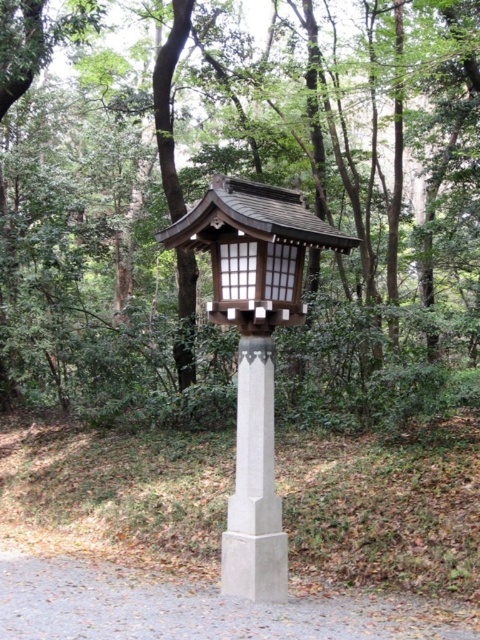
Does green leafy tree at center have a greater width compared to matte wood lantern at center?

Correct, the width of green leafy tree at center exceeds that of matte wood lantern at center.

Who is positioned more to the left, green leafy tree at center or matte wood lantern at center?

From the viewer's perspective, green leafy tree at center appears more on the left side.

I want to click on green leafy tree at center, so click(x=231, y=204).

Is green leafy tree at center closer to the viewer compared to gray concrete post at center?

Yes, green leafy tree at center is closer to the viewer.

Does green leafy tree at center have a greater width compared to gray concrete post at center?

Yes, green leafy tree at center is wider than gray concrete post at center.

Which is in front, point (170, 179) or point (241, 515)?

Point (241, 515) is in front.

The height and width of the screenshot is (640, 480). I want to click on green leafy tree at center, so click(231, 204).

Is matte wood lantern at center thinner than gray concrete post at center?

In fact, matte wood lantern at center might be wider than gray concrete post at center.

Can you confirm if matte wood lantern at center is positioned to the left of gray concrete post at center?

Incorrect, matte wood lantern at center is not on the left side of gray concrete post at center.

At what (x,y) coordinates should I click in order to perform the action: click on matte wood lantern at center. Please return your answer as a coordinate pair (x, y). The image size is (480, 640). Looking at the image, I should click on (253, 250).

Image resolution: width=480 pixels, height=640 pixels. In order to click on matte wood lantern at center in this screenshot , I will do `click(253, 250)`.